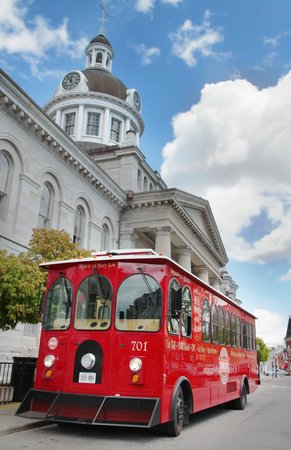
I want to click on windows, so click(59, 306), click(99, 300), click(128, 301), click(174, 314), click(186, 306), click(206, 314), click(215, 315), click(221, 316), click(227, 323), click(232, 328).